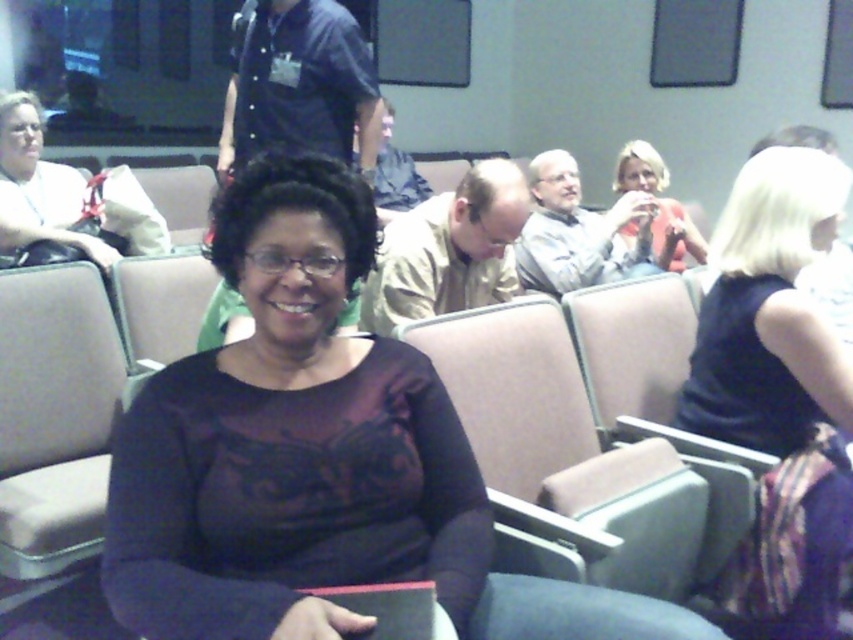
Does matte white shirt at left appear over matte pink phone at upper right?

Incorrect, matte white shirt at left is not positioned above matte pink phone at upper right.

Is point (53, 211) positioned before point (701, 243)?

Yes, point (53, 211) is closer to viewer.

Is point (4, 177) positioned behind point (621, 168)?

No, (4, 177) is in front of (621, 168).

Image resolution: width=853 pixels, height=640 pixels. I want to click on matte white shirt at left, so click(x=38, y=186).

Is point (425, 464) farther from camera compared to point (846, 540)?

No, (425, 464) is in front of (846, 540).

Does dark purple satin blouse at center lie behind black fabric dress at right?

No.

Between point (155, 611) and point (772, 516), which one is positioned behind?

The point (772, 516) is more distant.

Image resolution: width=853 pixels, height=640 pixels. In order to click on dark purple satin blouse at center in this screenshot , I will do `click(289, 442)`.

Between black fabric dress at right and matte white shirt at left, which one appears on the left side from the viewer's perspective?

matte white shirt at left

Does point (755, 449) lie in front of point (68, 170)?

Yes, it is in front of point (68, 170).

Between point (815, 380) and point (68, 221), which one is positioned in front?

Point (815, 380) is in front.

The height and width of the screenshot is (640, 853). I want to click on black fabric dress at right, so click(x=778, y=390).